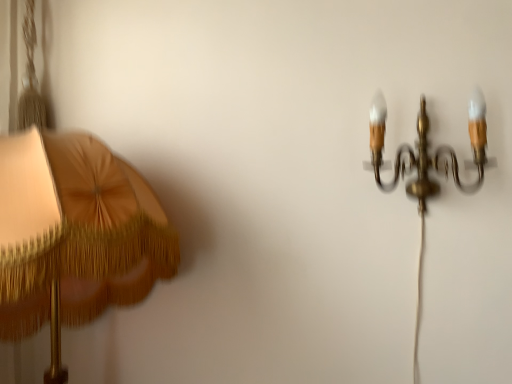
I want to click on matte gold lampshade at left, which appears as the 1th lamp when viewed from the left, so click(x=71, y=226).

What is the approximate height of matte gold lampshade at left, which appears as the 1th lamp when viewed from the left?

The height of matte gold lampshade at left, which appears as the 1th lamp when viewed from the left, is 28.48 inches.

Describe the element at coordinates (71, 226) in the screenshot. I see `matte gold lampshade at left, the 2th lamp viewed from the right` at that location.

Measure the distance between point (102, 169) and camera.

Point (102, 169) is 95.70 centimeters from camera.

You are a GUI agent. You are given a task and a screenshot of the screen. Output one action in this format:
    pyautogui.click(x=<x>, y=<y>)
    Task: Click on the gold brass chandelier at upper right, the first lamp viewed from the right
    
    Given the screenshot: What is the action you would take?
    pyautogui.click(x=426, y=151)

What do you see at coordinates (426, 151) in the screenshot? I see `gold brass chandelier at upper right, the 2th lamp from the left` at bounding box center [426, 151].

The image size is (512, 384). Find the location of `matte gold lampshade at left, which appears as the 1th lamp when viewed from the left`. matte gold lampshade at left, which appears as the 1th lamp when viewed from the left is located at coordinates (71, 226).

Would you say matte gold lampshade at left, which appears as the 1th lamp when viewed from the left, is to the left or to the right of gold brass chandelier at upper right, the 2th lamp from the left, in the picture?

Based on their positions, matte gold lampshade at left, which appears as the 1th lamp when viewed from the left, is located to the left of gold brass chandelier at upper right, the 2th lamp from the left.

Is matte gold lampshade at left, which appears as the 1th lamp when viewed from the left, positioned behind gold brass chandelier at upper right, the first lamp viewed from the right?

No, matte gold lampshade at left, which appears as the 1th lamp when viewed from the left, is closer to the camera.

Does point (24, 260) lie in front of point (444, 166)?

Yes, it is.

From the image's perspective, is matte gold lampshade at left, which appears as the 1th lamp when viewed from the left, under gold brass chandelier at upper right, the first lamp viewed from the right?

Yes, from the image's perspective, matte gold lampshade at left, which appears as the 1th lamp when viewed from the left, is below gold brass chandelier at upper right, the first lamp viewed from the right.

From a real-world perspective, is matte gold lampshade at left, the 2th lamp viewed from the right, positioned above or below gold brass chandelier at upper right, the first lamp viewed from the right?

matte gold lampshade at left, the 2th lamp viewed from the right, is below gold brass chandelier at upper right, the first lamp viewed from the right.

Is matte gold lampshade at left, the 2th lamp viewed from the right, wider than gold brass chandelier at upper right, the 2th lamp from the left?

Indeed, matte gold lampshade at left, the 2th lamp viewed from the right, has a greater width compared to gold brass chandelier at upper right, the 2th lamp from the left.

Can you confirm if matte gold lampshade at left, which appears as the 1th lamp when viewed from the left, is taller than gold brass chandelier at upper right, the 2th lamp from the left?

Yes, matte gold lampshade at left, which appears as the 1th lamp when viewed from the left, is taller than gold brass chandelier at upper right, the 2th lamp from the left.

Considering the relative sizes of matte gold lampshade at left, which appears as the 1th lamp when viewed from the left, and gold brass chandelier at upper right, the first lamp viewed from the right, in the image provided, is matte gold lampshade at left, which appears as the 1th lamp when viewed from the left, bigger than gold brass chandelier at upper right, the first lamp viewed from the right,?

Correct, matte gold lampshade at left, which appears as the 1th lamp when viewed from the left, is larger in size than gold brass chandelier at upper right, the first lamp viewed from the right.

Is gold brass chandelier at upper right, the first lamp viewed from the right, completely or partially inside matte gold lampshade at left, the 2th lamp viewed from the right?

No, matte gold lampshade at left, the 2th lamp viewed from the right, does not contain gold brass chandelier at upper right, the first lamp viewed from the right.

Would you consider matte gold lampshade at left, the 2th lamp viewed from the right, to be distant from gold brass chandelier at upper right, the 2th lamp from the left?

They are positioned close to each other.

Is matte gold lampshade at left, which appears as the 1th lamp when viewed from the left, turned away from gold brass chandelier at upper right, the 2th lamp from the left?

No, gold brass chandelier at upper right, the 2th lamp from the left, is not at the back of matte gold lampshade at left, which appears as the 1th lamp when viewed from the left.

Can you tell me how much matte gold lampshade at left, which appears as the 1th lamp when viewed from the left, and gold brass chandelier at upper right, the 2th lamp from the left, differ in facing direction?

0.538 degrees.

Find the location of `lamp below the gold brass chandelier at upper right, the 2th lamp from the left (from the image's perspective)`. lamp below the gold brass chandelier at upper right, the 2th lamp from the left (from the image's perspective) is located at coordinates click(71, 226).

Based on the photo, can you confirm if gold brass chandelier at upper right, the first lamp viewed from the right, is positioned to the left of matte gold lampshade at left, the 2th lamp viewed from the right?

No.

Is gold brass chandelier at upper right, the 2th lamp from the left, further to the viewer compared to matte gold lampshade at left, the 2th lamp viewed from the right?

Yes, gold brass chandelier at upper right, the 2th lamp from the left, is behind matte gold lampshade at left, the 2th lamp viewed from the right.

Considering the points (380, 92) and (65, 154), which point is in front, point (380, 92) or point (65, 154)?

Positioned in front is point (65, 154).

From the image's perspective, is gold brass chandelier at upper right, the first lamp viewed from the right, beneath matte gold lampshade at left, the 2th lamp viewed from the right?

No, from the image's perspective, gold brass chandelier at upper right, the first lamp viewed from the right, is not below matte gold lampshade at left, the 2th lamp viewed from the right.

From a real-world perspective, is gold brass chandelier at upper right, the 2th lamp from the left, located beneath matte gold lampshade at left, the 2th lamp viewed from the right?

Result: No.

Considering the sizes of objects gold brass chandelier at upper right, the 2th lamp from the left, and matte gold lampshade at left, which appears as the 1th lamp when viewed from the left, in the image provided, who is wider, gold brass chandelier at upper right, the 2th lamp from the left, or matte gold lampshade at left, which appears as the 1th lamp when viewed from the left,?

matte gold lampshade at left, which appears as the 1th lamp when viewed from the left.

Considering the sizes of objects gold brass chandelier at upper right, the 2th lamp from the left, and matte gold lampshade at left, the 2th lamp viewed from the right, in the image provided, who is taller, gold brass chandelier at upper right, the 2th lamp from the left, or matte gold lampshade at left, the 2th lamp viewed from the right,?

matte gold lampshade at left, the 2th lamp viewed from the right.

Which of these two, gold brass chandelier at upper right, the first lamp viewed from the right, or matte gold lampshade at left, which appears as the 1th lamp when viewed from the left, is bigger?

matte gold lampshade at left, which appears as the 1th lamp when viewed from the left, is bigger.

Which is correct: gold brass chandelier at upper right, the first lamp viewed from the right, is inside matte gold lampshade at left, which appears as the 1th lamp when viewed from the left, or outside of it?

Result: gold brass chandelier at upper right, the first lamp viewed from the right, is spatially situated outside matte gold lampshade at left, which appears as the 1th lamp when viewed from the left.

Would you consider gold brass chandelier at upper right, the first lamp viewed from the right, to be distant from matte gold lampshade at left, the 2th lamp viewed from the right?

No, gold brass chandelier at upper right, the first lamp viewed from the right, is not far away from matte gold lampshade at left, the 2th lamp viewed from the right.

Is gold brass chandelier at upper right, the 2th lamp from the left, facing towards matte gold lampshade at left, which appears as the 1th lamp when viewed from the left?

No, gold brass chandelier at upper right, the 2th lamp from the left, is not oriented towards matte gold lampshade at left, which appears as the 1th lamp when viewed from the left.

How far apart are gold brass chandelier at upper right, the first lamp viewed from the right, and matte gold lampshade at left, the 2th lamp viewed from the right?

gold brass chandelier at upper right, the first lamp viewed from the right, and matte gold lampshade at left, the 2th lamp viewed from the right, are 27.00 inches apart from each other.

Locate an element on the screen. lamp on the left of gold brass chandelier at upper right, the 2th lamp from the left is located at coordinates (71, 226).

Locate an element on the screen. lamp on the left of gold brass chandelier at upper right, the first lamp viewed from the right is located at coordinates (71, 226).

Identify the location of lamp lying above the matte gold lampshade at left, which appears as the 1th lamp when viewed from the left (from the image's perspective). (426, 151).